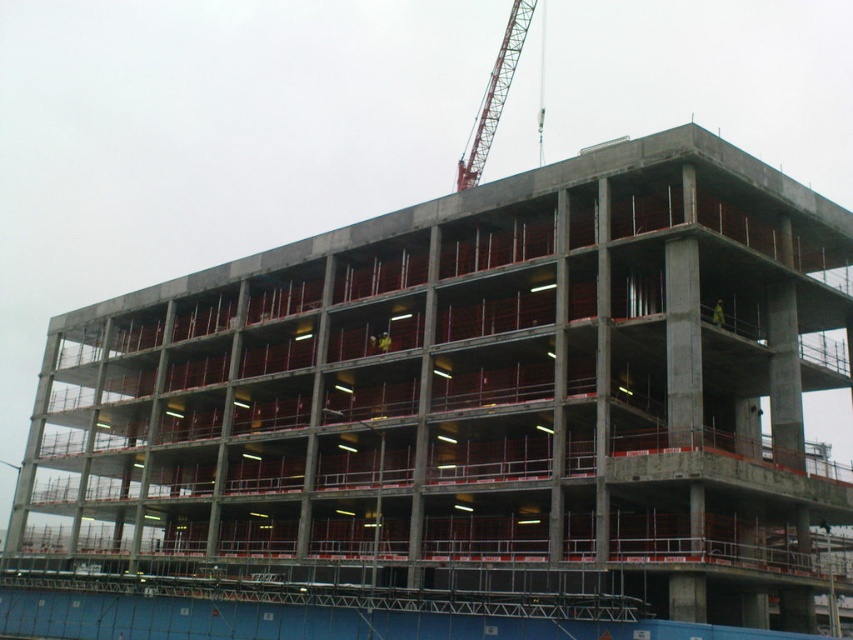
Based on the photo, you are a construction worker who needs to move a heavy beam from the metallic red crane at upper center to the yellow reflective vest at upper center. Given that the crane can only reach 100 meters, will you be able to move the beam directly without needing additional equipment?

The metallic red crane at upper center and yellow reflective vest at upper center are 129.37 meters apart, which exceeds the crane s 100 meter reach. Therefore, you will need additional equipment to move the beam.

You are an inspector standing at the entrance of the construction site. You notice two points marked on the structure. The first point is at coordinate point (456, 186) and the second is at point (721, 310). From your vantage point at the entrance, which point is closer to you?

Point (721, 310) is closer to you because it is in front of point (456, 186) according to their spatial arrangement.